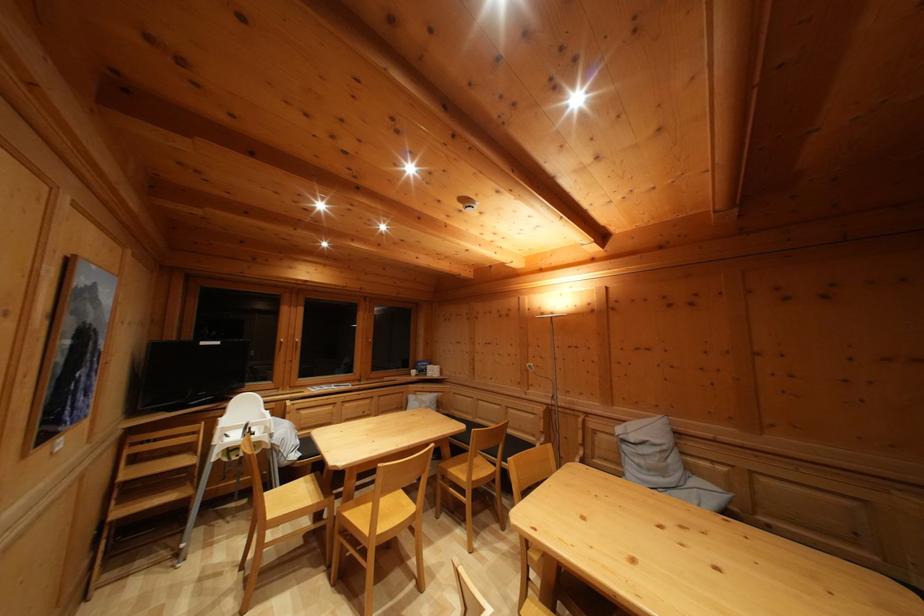
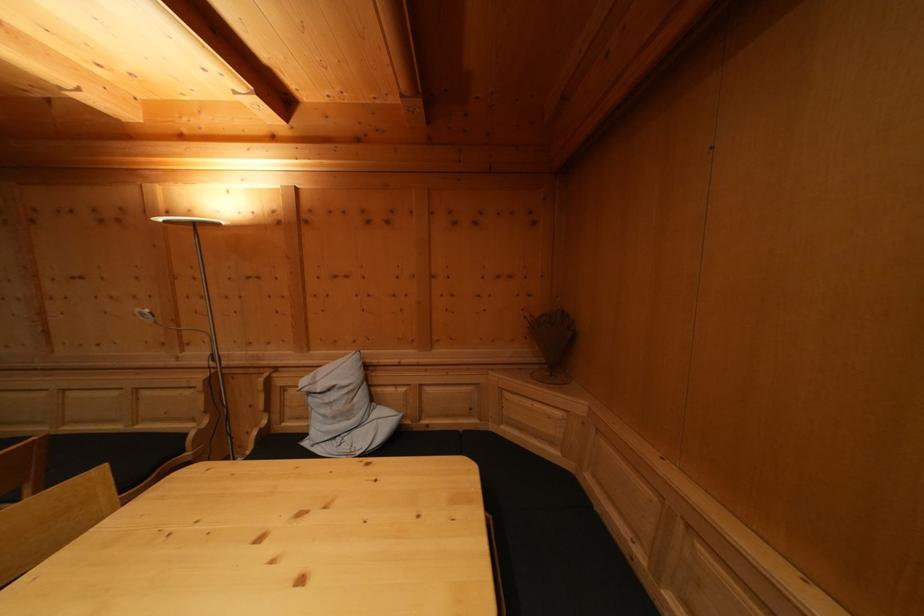
Question: Based on the continuous images, in which direction is the camera rotating? Reply with the corresponding letter.

Choices:
 (A) Left
 (B) Right
 (C) Up
 (D) Down

Answer: (B)